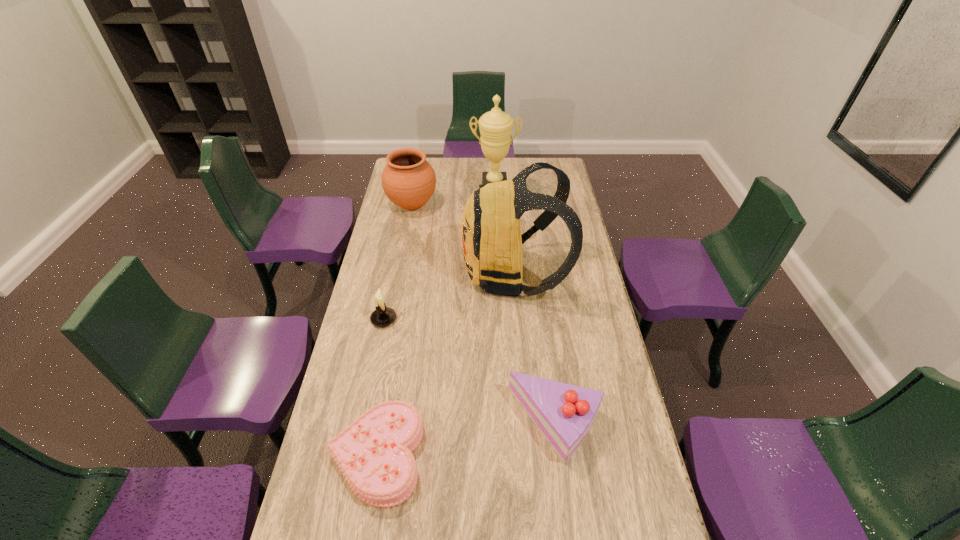
Identify the location of trophy cup. This screenshot has width=960, height=540. (495, 126).

Locate an element on the screen. backpack is located at coordinates click(492, 241).

The width and height of the screenshot is (960, 540). I want to click on the second tallest object, so pos(492,241).

Locate an element on the screen. The height and width of the screenshot is (540, 960). pottery is located at coordinates (408, 180).

The image size is (960, 540). I want to click on candle holder, so click(x=382, y=316).

Where is `the taller cake`? the taller cake is located at coordinates coord(564,413).

The width and height of the screenshot is (960, 540). Identify the location of the left cake. (374, 454).

Identify the location of the shortest object. The width and height of the screenshot is (960, 540). (374, 454).

You are a GUI agent. You are given a task and a screenshot of the screen. Output one action in this format:
    pyautogui.click(x=<x>, y=<y>)
    Task: Click on the free space located 0.320m at the front of the trophy cup with handles
    
    Given the screenshot: What is the action you would take?
    (496, 251)

You are a GUI agent. You are given a task and a screenshot of the screen. Output one action in this format:
    pyautogui.click(x=<x>, y=<y>)
    Task: Click on the vacant space located on the front-facing side of the fifth shortest object
    
    Given the screenshot: What is the action you would take?
    pyautogui.click(x=425, y=273)